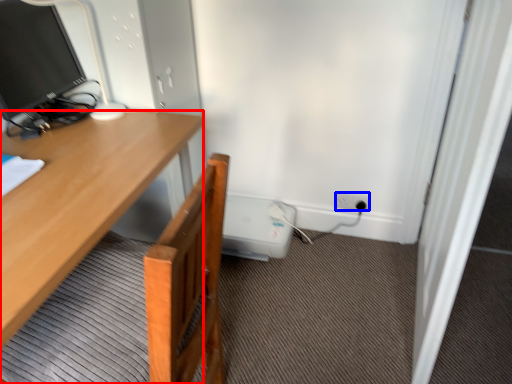
Question: Among these objects, which one is farthest to the camera, desk (highlighted by a red box) or power outlet (highlighted by a blue box)?

Choices:
 (A) desk
 (B) power outlet

Answer: (B)